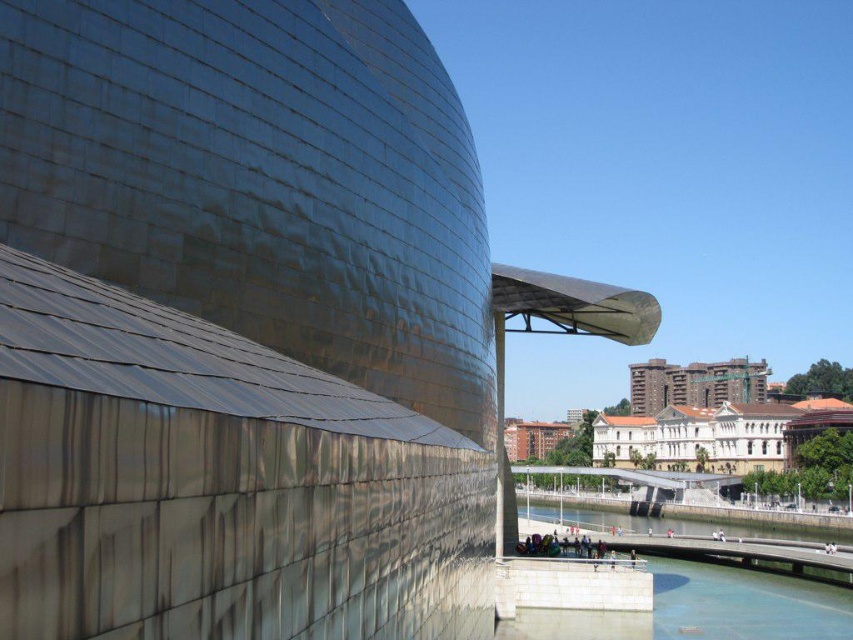
Question: Is clear glass water at lower center above clear water at lower center?

Choices:
 (A) no
 (B) yes

Answer: (B)

Question: Does clear glass water at lower center have a greater width compared to dark brown brick building at center?

Choices:
 (A) yes
 (B) no

Answer: (A)

Question: Which of the following is the farthest from the observer?

Choices:
 (A) clear water at lower center
 (B) clear glass water at lower center

Answer: (A)

Question: Which point is farther to the camera?

Choices:
 (A) (643, 412)
 (B) (546, 612)

Answer: (A)

Question: Which point appears farthest from the camera in this image?

Choices:
 (A) (640, 634)
 (B) (628, 529)

Answer: (B)

Question: Can you confirm if clear glass water at lower center is positioned to the right of clear water at lower center?

Choices:
 (A) no
 (B) yes

Answer: (A)